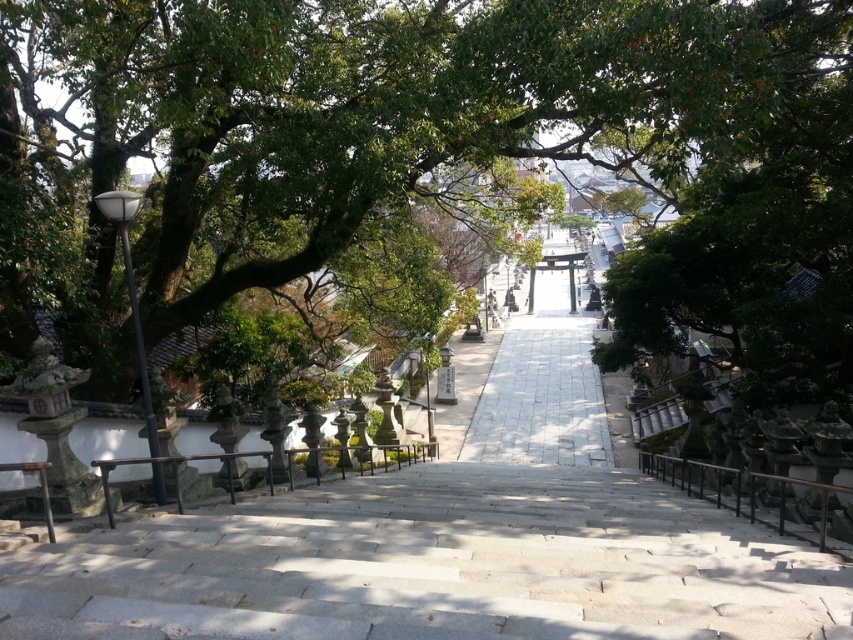
You are standing at the base of the stone staircase leading to the torii gate in the Japanese shrine. There are two points marked on the path ahead of you. The first point is located at coordinates point (221, 115), and the second point is at point (697, 493). If you were to walk from the base of the staircase towards the torii gate, which point would you encounter first?

You would encounter point (221, 115) first because it is in front of point (697, 493) along the path towards the torii gate.